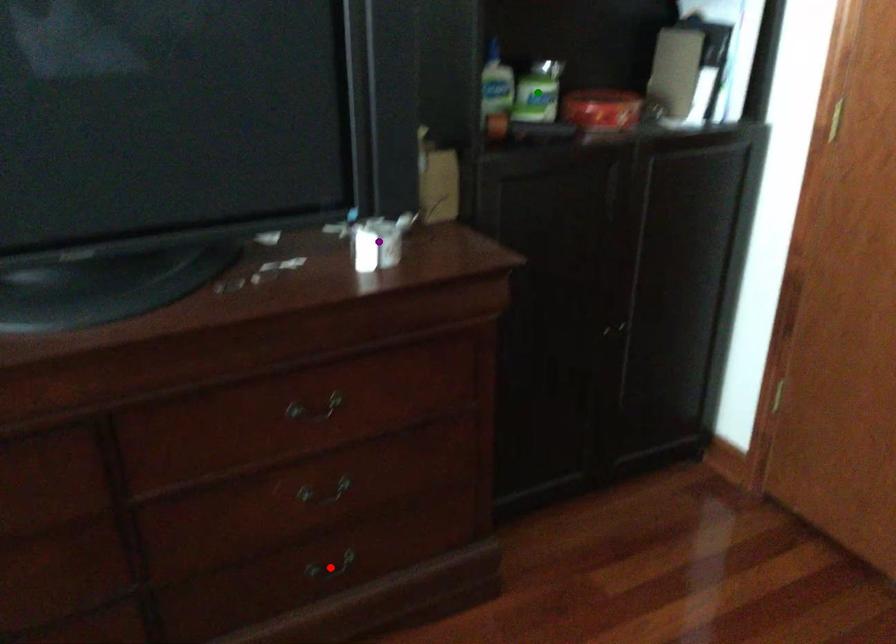
Order these from nearest to farthest:
1. purple point
2. green point
3. red point

purple point, red point, green point